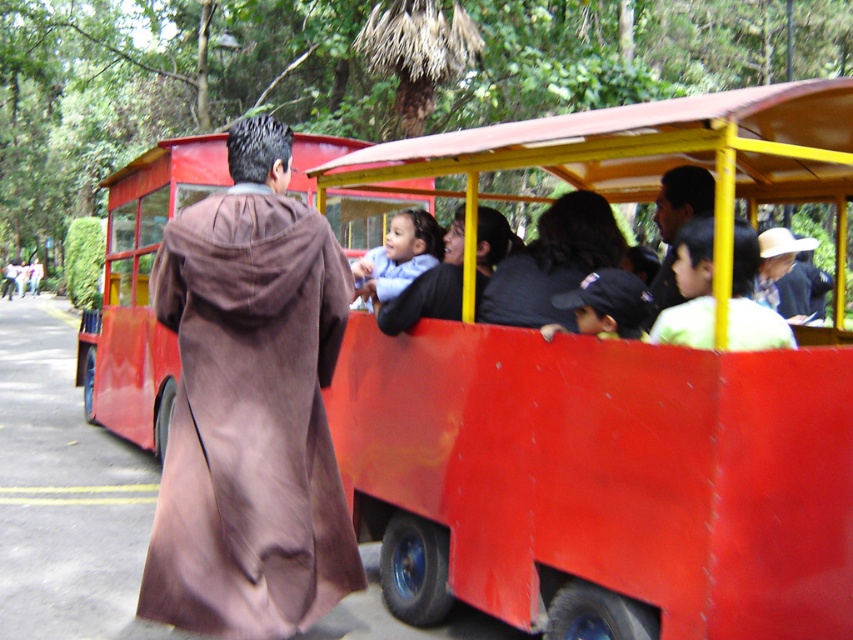
Can you confirm if matte red bus at center is shorter than light blue fabric baby at center?

No.

Is matte red bus at center to the right of light blue fabric baby at center from the viewer's perspective?

In fact, matte red bus at center is to the left of light blue fabric baby at center.

Does point (312, 147) come farther from viewer compared to point (398, 292)?

Yes.

Identify the location of matte red bus at center. This screenshot has width=853, height=640. (141, 289).

Which is more to the right, dark brown fabric jacket at center or smooth brown robe at upper right?

From the viewer's perspective, smooth brown robe at upper right appears more on the right side.

Is dark brown fabric jacket at center positioned at the back of smooth brown robe at upper right?

Yes, it is.

Where is `dark brown fabric jacket at center`? This screenshot has width=853, height=640. dark brown fabric jacket at center is located at coordinates (552, 262).

The height and width of the screenshot is (640, 853). Identify the location of dark brown fabric jacket at center. (552, 262).

Does point (575, 260) come farther from viewer compared to point (363, 282)?

That is False.

Describe the element at coordinates (552, 262) in the screenshot. Image resolution: width=853 pixels, height=640 pixels. I see `dark brown fabric jacket at center` at that location.

Between point (497, 298) and point (438, 244), which one is positioned in front?

Point (497, 298) is in front.

Where is `dark brown fabric jacket at center`? dark brown fabric jacket at center is located at coordinates (552, 262).